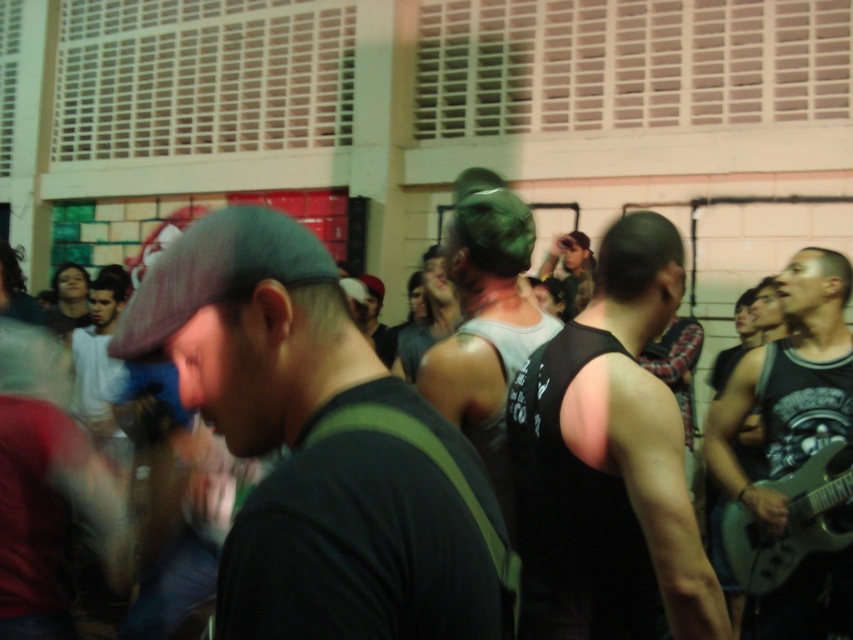
Question: Which object is farther from the camera taking this photo?

Choices:
 (A) green metallic guitar at lower right
 (B) black matte tank top at center
 (C) gray matte tank top at center
 (D) matte green cap at center

Answer: (D)

Question: Which of the following is the farthest from the observer?

Choices:
 (A) black tank top at right
 (B) matte green cap at center
 (C) black matte tank top at center
 (D) green metallic guitar at lower right

Answer: (B)

Question: Can you confirm if black matte tank top at center is positioned to the left of green metallic guitar at lower right?

Choices:
 (A) no
 (B) yes

Answer: (B)

Question: Can you confirm if black tank top at right is positioned to the right of green metallic guitar at lower right?

Choices:
 (A) yes
 (B) no

Answer: (A)

Question: Can you confirm if black tank top at right is positioned to the right of green metallic guitar at lower right?

Choices:
 (A) yes
 (B) no

Answer: (A)

Question: Considering the real-world distances, which object is closest to the gray matte tank top at center?

Choices:
 (A) black matte tank top at center
 (B) black tank top at right
 (C) green metallic guitar at lower right

Answer: (A)